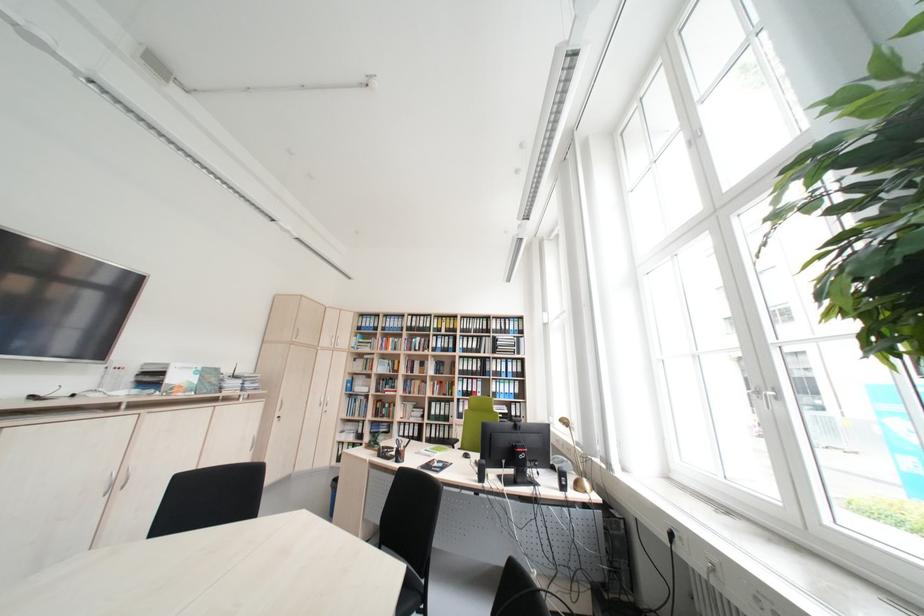
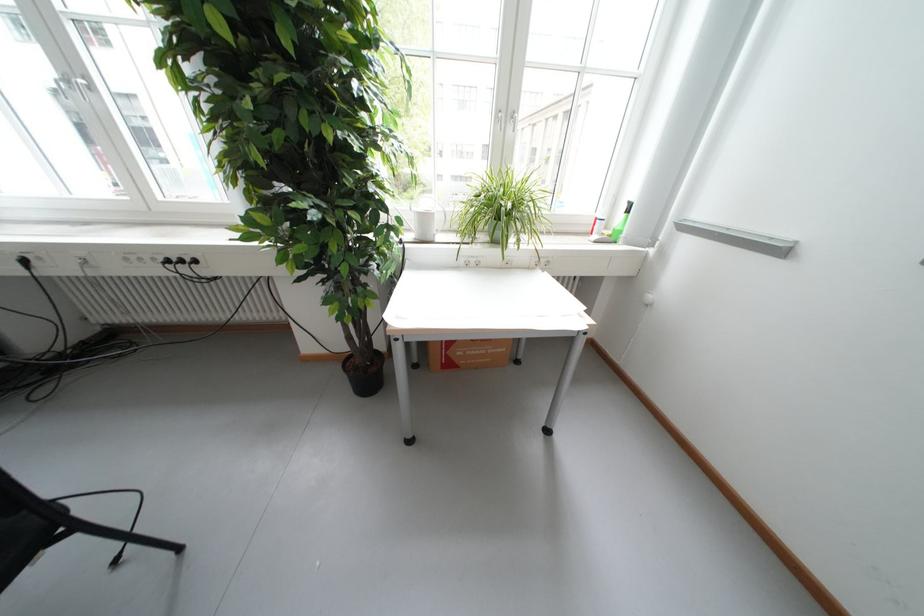
In the scene shown: Based on the continuous images, in which direction is the camera rotating?

The camera rotated toward right-down.